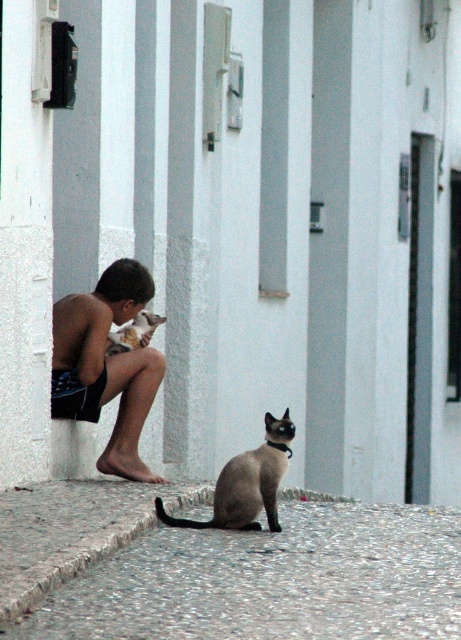
You are a photographer standing in front of the scene. You want to take a photo of the smokey gray fur at lower center and the brown fur cat at left. Which one will appear larger in the photo?

The smokey gray fur at lower center will appear larger in the photo because it is closer to the viewer than the brown fur cat at left.

Where is the smokey gray fur at lower center located in the image?

The smokey gray fur at lower center is located at point (247,483) in the image.

You are a delivery person trying to place a small package on the gray gravel at lower center located at point (271, 580). The package is 15 cm wide. Can you fit it there?

The gray gravel at lower center is located at point (271, 580). However, the description does not provide information about its size, so it is unclear if the package will fit there.